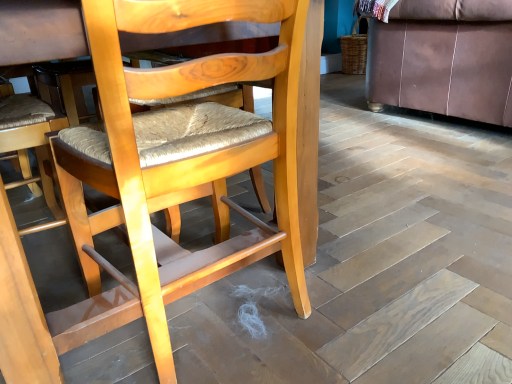
Question: Is brown leather couch at right positioned in front of light brown wood chair at center?

Choices:
 (A) no
 (B) yes

Answer: (A)

Question: Considering the relative sizes of brown leather couch at right and light brown wood chair at center in the image provided, is brown leather couch at right smaller than light brown wood chair at center?

Choices:
 (A) yes
 (B) no

Answer: (B)

Question: From a real-world perspective, is brown leather couch at right positioned under light brown wood chair at center based on gravity?

Choices:
 (A) no
 (B) yes

Answer: (A)

Question: Is brown leather couch at right wider than light brown wood chair at center?

Choices:
 (A) yes
 (B) no

Answer: (A)

Question: Is brown leather couch at right facing towards light brown wood chair at center?

Choices:
 (A) yes
 (B) no

Answer: (B)

Question: Does brown leather couch at right appear on the right side of light brown wood chair at center?

Choices:
 (A) no
 (B) yes

Answer: (B)

Question: From the image's perspective, would you say light brown wood chair at center is positioned over brown leather couch at right?

Choices:
 (A) no
 (B) yes

Answer: (A)

Question: Is light brown wood chair at center turned away from brown leather couch at right?

Choices:
 (A) yes
 (B) no

Answer: (B)

Question: Is light brown wood chair at center not near brown leather couch at right?

Choices:
 (A) yes
 (B) no

Answer: (A)

Question: Is light brown wood chair at center positioned beyond the bounds of brown leather couch at right?

Choices:
 (A) no
 (B) yes

Answer: (B)

Question: Is light brown wood chair at center bigger than brown leather couch at right?

Choices:
 (A) no
 (B) yes

Answer: (A)

Question: Does light brown wood chair at center have a greater height compared to brown leather couch at right?

Choices:
 (A) no
 (B) yes

Answer: (B)

Question: From the image's perspective, is brown leather couch at right positioned above or below light brown wood chair at center?

Choices:
 (A) above
 (B) below

Answer: (A)